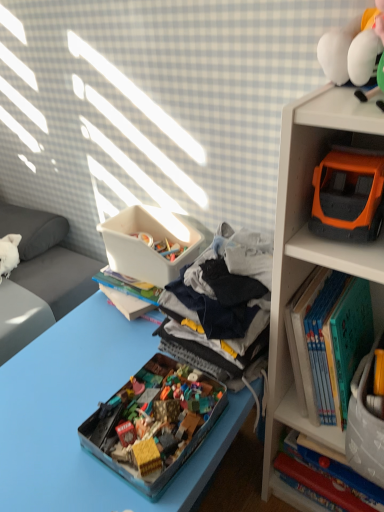
Question: From a real-world perspective, is orange plastic toy car at upper right physically above hardcover book at right, marked as the first book in a bottom-to-top arrangement?

Choices:
 (A) no
 (B) yes

Answer: (B)

Question: Is orange plastic toy car at upper right closer to camera compared to hardcover book at right, placed as the second book when sorted from top to bottom?

Choices:
 (A) yes
 (B) no

Answer: (A)

Question: Is orange plastic toy car at upper right next to hardcover book at right, placed as the second book when sorted from top to bottom, and touching it?

Choices:
 (A) yes
 (B) no

Answer: (B)

Question: Could you tell me if orange plastic toy car at upper right is facing hardcover book at right, marked as the first book in a bottom-to-top arrangement?

Choices:
 (A) no
 (B) yes

Answer: (B)

Question: Can you confirm if orange plastic toy car at upper right is bigger than hardcover book at right, placed as the second book when sorted from top to bottom?

Choices:
 (A) no
 (B) yes

Answer: (B)

Question: Does orange plastic toy car at upper right have a lesser width compared to hardcover book at right, marked as the first book in a bottom-to-top arrangement?

Choices:
 (A) yes
 (B) no

Answer: (B)

Question: Is white plastic container at center positioned behind gray cotton clothes at center?

Choices:
 (A) yes
 (B) no

Answer: (A)

Question: Considering the relative sizes of white plastic container at center and gray cotton clothes at center in the image provided, is white plastic container at center shorter than gray cotton clothes at center?

Choices:
 (A) yes
 (B) no

Answer: (A)

Question: Would you say white plastic container at center is a long distance from gray cotton clothes at center?

Choices:
 (A) no
 (B) yes

Answer: (A)

Question: Is white plastic container at center in contact with gray cotton clothes at center?

Choices:
 (A) yes
 (B) no

Answer: (B)

Question: From a real-world perspective, is white plastic container at center under gray cotton clothes at center?

Choices:
 (A) no
 (B) yes

Answer: (B)

Question: Is white plastic container at center oriented towards gray cotton clothes at center?

Choices:
 (A) no
 (B) yes

Answer: (A)

Question: From the image's perspective, is translucent plastic toy box at center under white plastic container at center?

Choices:
 (A) yes
 (B) no

Answer: (A)